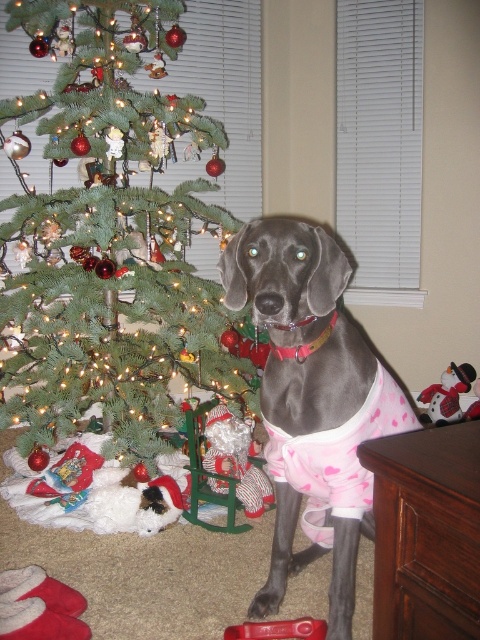
Question: Does green matte christmas tree at center have a lesser width compared to shiny gray dog at center?

Choices:
 (A) yes
 (B) no

Answer: (B)

Question: Is green matte christmas tree at center bigger than shiny gray dog at center?

Choices:
 (A) yes
 (B) no

Answer: (A)

Question: Which object appears farthest from the camera in this image?

Choices:
 (A) shiny gray dog at center
 (B) green matte christmas tree at center

Answer: (B)

Question: Which object is closer to the camera taking this photo?

Choices:
 (A) green matte christmas tree at center
 (B) shiny gray dog at center

Answer: (B)

Question: Is green matte christmas tree at center wider than shiny gray dog at center?

Choices:
 (A) yes
 (B) no

Answer: (A)